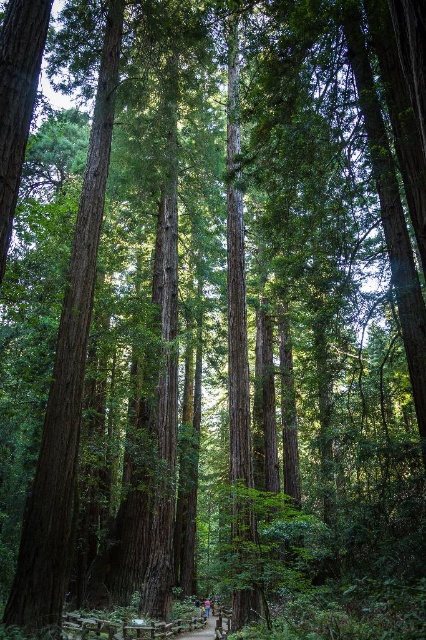
Question: Is brown wooden path at center to the left of blue denim jeans at center from the viewer's perspective?

Choices:
 (A) no
 (B) yes

Answer: (A)

Question: Considering the relative positions of brown wooden path at center and blue denim jeans at center in the image provided, where is brown wooden path at center located with respect to blue denim jeans at center?

Choices:
 (A) right
 (B) left

Answer: (A)

Question: Does brown wooden path at center have a smaller size compared to blue denim jeans at center?

Choices:
 (A) yes
 (B) no

Answer: (B)

Question: Which point is farther from the camera taking this photo?

Choices:
 (A) [x=204, y=605]
 (B) [x=213, y=618]

Answer: (A)

Question: Which point appears closest to the camera in this image?

Choices:
 (A) (204, 608)
 (B) (186, 636)

Answer: (B)

Question: Among these objects, which one is nearest to the camera?

Choices:
 (A) blue denim jeans at center
 (B) brown wooden path at center

Answer: (B)